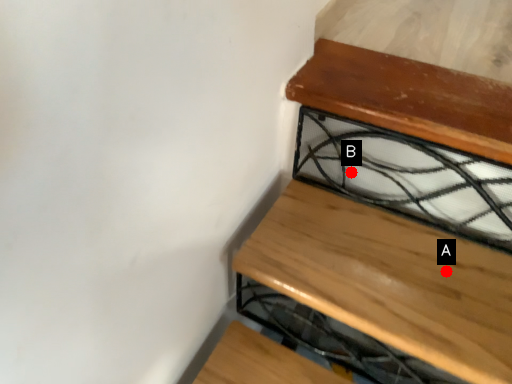
Question: Two points are circled on the image, labeled by A and B beside each circle. Which of the following is the farthest from the observer?

Choices:
 (A) A is further
 (B) B is further

Answer: (B)